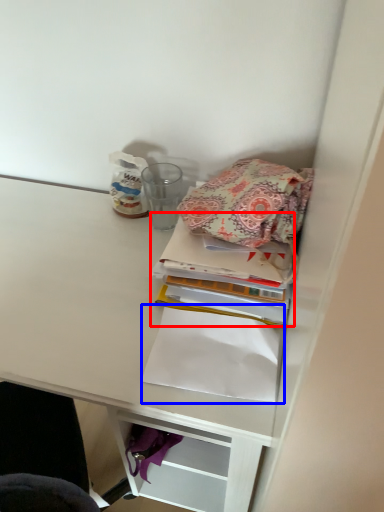
Question: Which object is closer to the camera taking this photo, book (highlighted by a red box) or notebook (highlighted by a blue box)?

Choices:
 (A) book
 (B) notebook

Answer: (B)